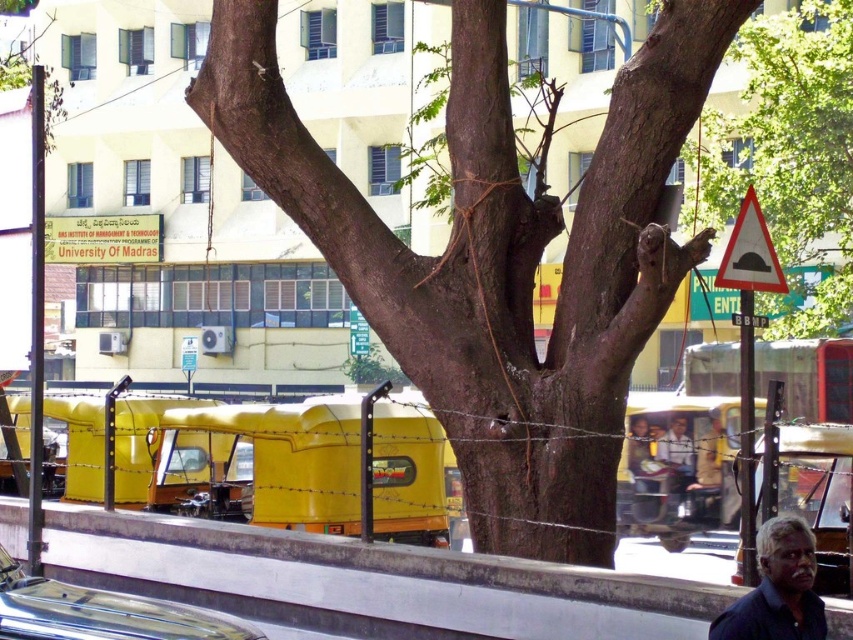
You are standing at the point labeled as point (x=367, y=582) in the image. Looking around, you see the large tree with ropes on its branches and the University of Madras building in the background. Which direction should you walk to reach the tree first?

Since the point (x=367, y=582) is on the white concrete pavement at lower center, you should walk towards the tree in the foreground direction to reach it first.